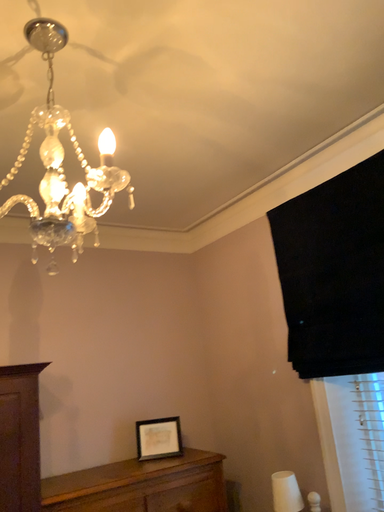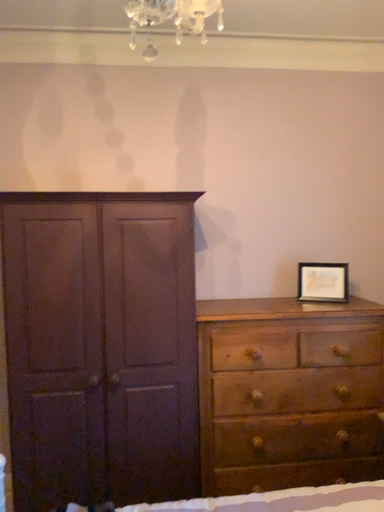
Question: Which way did the camera rotate in the video?

Choices:
 (A) rotated downward
 (B) rotated upward

Answer: (A)